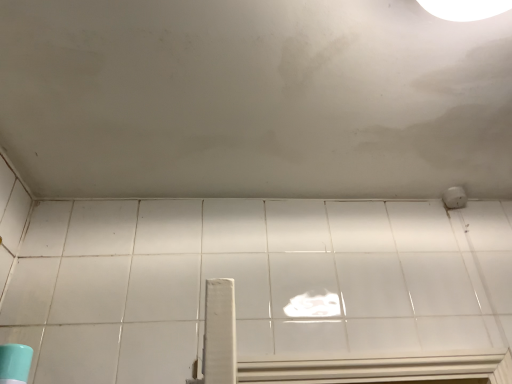
What do you see at coordinates (24, 341) in the screenshot? I see `teal glossy cup at lower left` at bounding box center [24, 341].

From the picture: In order to face teal glossy cup at lower left, should I rotate leftwards or rightwards?

To face it directly, rotate left by 31.373 degrees.

Locate an element on the screen. teal glossy cup at lower left is located at coordinates (24, 341).

At what (x,y) coordinates should I click in order to perform the action: click on teal glossy cup at lower left. Please return your answer as a coordinate pair (x, y). The width and height of the screenshot is (512, 384). Looking at the image, I should click on (24, 341).